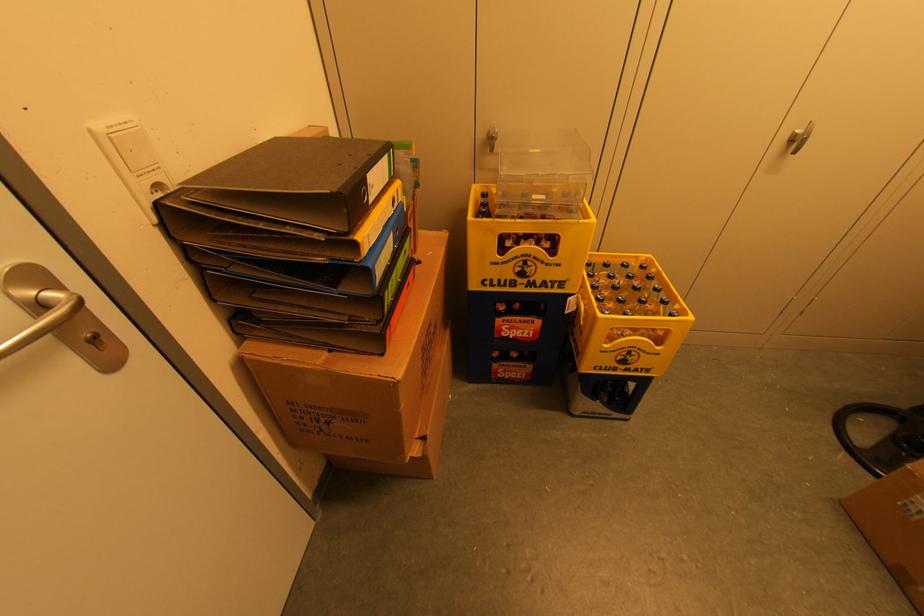
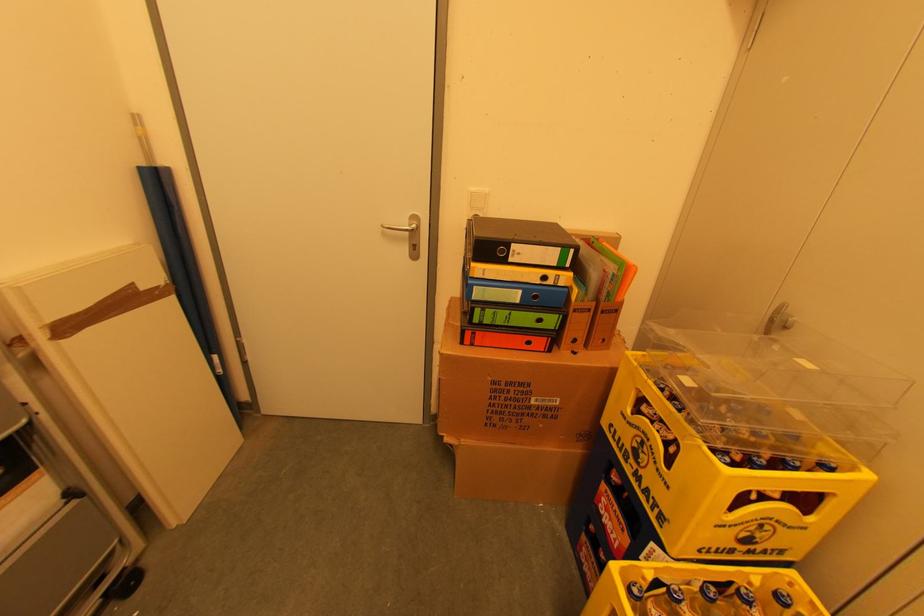
From the picture: First-person continuous shooting, in which direction is the camera rotating?

The rotation direction of the camera is left-down.